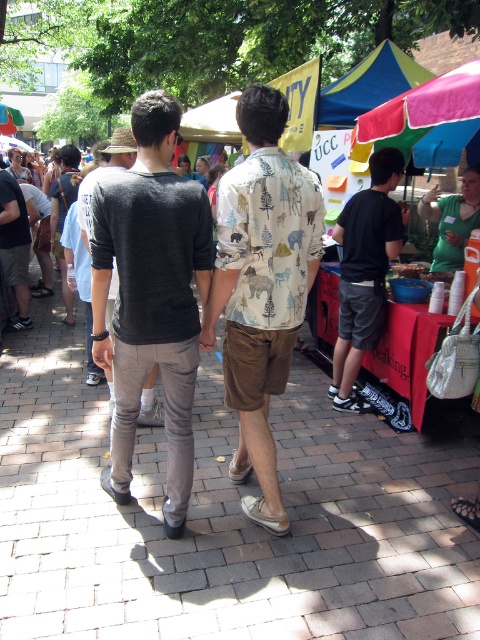
Measure the distance between point (x=145, y=173) and camera.

Point (x=145, y=173) is 8.28 feet away from camera.

Does dark gray cotton shirt at center have a greater width compared to printed cotton shirt at center?

Yes.

Is point (187, 444) farther from camera compared to point (252, 202)?

Yes.

Image resolution: width=480 pixels, height=640 pixels. Identify the location of dark gray cotton shirt at center. (152, 296).

Is point (302, 636) farther from camera compared to point (170, 328)?

No, it is in front of (170, 328).

Which is in front, point (336, 476) or point (123, 470)?

Point (123, 470) is more forward.

Between point (61, 428) and point (121, 336), which one is positioned behind?

Positioned behind is point (61, 428).

Find the location of a particular element. brick pavement at center is located at coordinates (226, 516).

Between gray cotton shirt at center and dark gray sweater at left, which one appears on the left side from the viewer's perspective?

dark gray sweater at left is more to the left.

Is point (84, 216) behind point (21, 218)?

No.

At what (x,y) coordinates should I click in order to perform the action: click on gray cotton shirt at center. Please return your answer as a coordinate pair (x, y). The image size is (480, 640). Looking at the image, I should click on (105, 173).